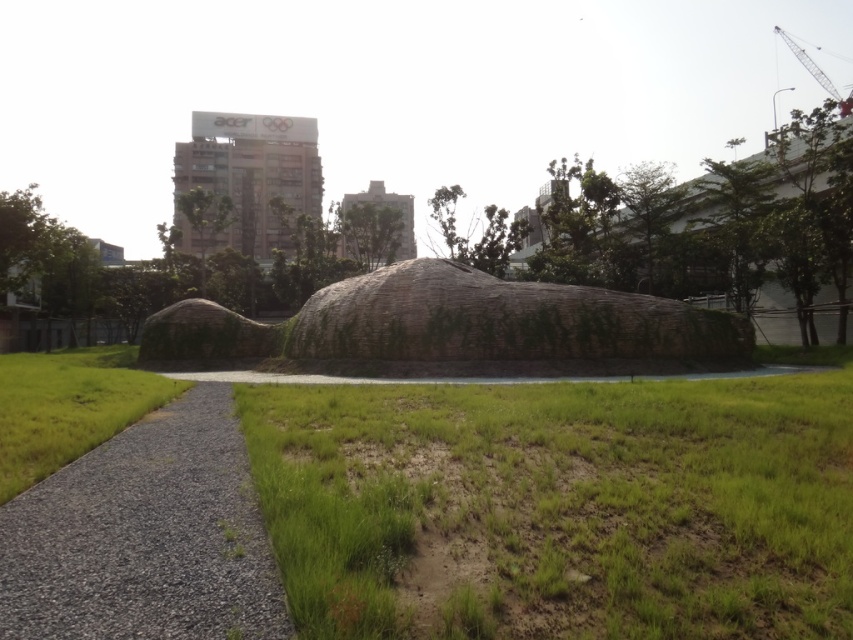
You are standing in the park and want to find the green grassy area at center. What is the 2D coordinate of the green grassy at center?

The 2D coordinate of the green grassy at center is at point (566, 504).